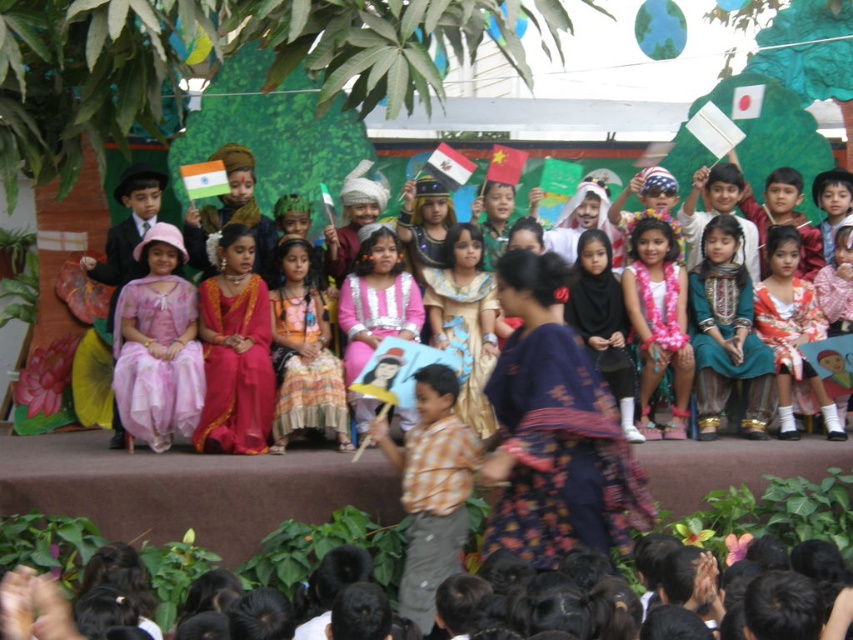
Can you confirm if multicolored fabric dress at center is bigger than white paper flag at center?

Actually, multicolored fabric dress at center might be smaller than white paper flag at center.

This screenshot has width=853, height=640. Describe the element at coordinates (311, 397) in the screenshot. I see `multicolored fabric dress at center` at that location.

Is point (345, 416) in front of point (448, 189)?

That is True.

Locate an element on the screen. The height and width of the screenshot is (640, 853). multicolored fabric dress at center is located at coordinates (311, 397).

Is matte pink sari at center to the right of gold shiny dress at center from the viewer's perspective?

Incorrect, matte pink sari at center is not on the right side of gold shiny dress at center.

Does matte pink sari at center appear on the left side of gold shiny dress at center?

Correct, you'll find matte pink sari at center to the left of gold shiny dress at center.

Identify the location of matte pink sari at center. (235, 369).

Image resolution: width=853 pixels, height=640 pixels. Identify the location of matte pink sari at center. (235, 369).

Is dark blue floral fabric dress at center taller than multicolored fabric dress at center?

Yes.

Is point (573, 458) positioned behind point (270, 449)?

No, it is not.

Identify the location of dark blue floral fabric dress at center. The height and width of the screenshot is (640, 853). (560, 452).